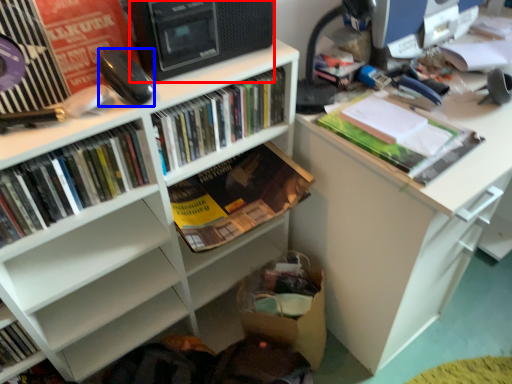
Question: Which object appears closest to the camera in this image, computer tower (highlighted by a red box) or equipment (highlighted by a blue box)?

Choices:
 (A) computer tower
 (B) equipment

Answer: (A)